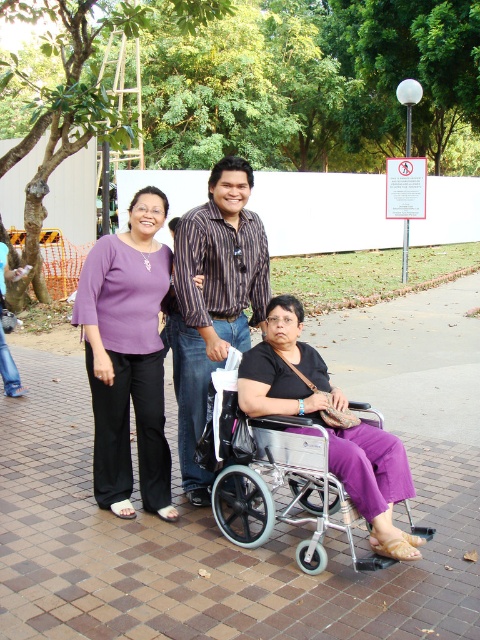
Is purple fabric shirt at upper left shorter than striped fabric shirt at center?

No.

Which is more to the left, purple fabric shirt at upper left or striped fabric shirt at center?

striped fabric shirt at center

Is point (370, 468) positioned in front of point (244, 348)?

Yes.

This screenshot has width=480, height=640. What are the coordinates of `purple fabric shirt at upper left` in the screenshot? It's located at (269, 362).

What are the coordinates of `purple fabric shirt at upper left` in the screenshot? It's located at (269, 362).

Is purple fabric shirt at upper left positioned behind silver metallic wheelchair at lower center?

That is False.

Who is higher up, purple fabric shirt at upper left or silver metallic wheelchair at lower center?

purple fabric shirt at upper left is above.

Is point (393, 435) farther from camera compared to point (316, 444)?

Yes.

This screenshot has width=480, height=640. What are the coordinates of `purple fabric shirt at upper left` in the screenshot? It's located at (269, 362).